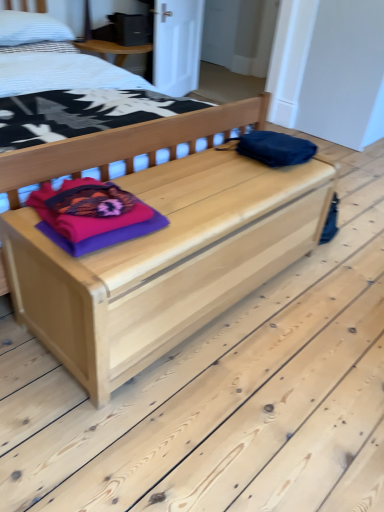
Locate an element on the screen. unoccupied space behind purple fabric at center is located at coordinates (155, 179).